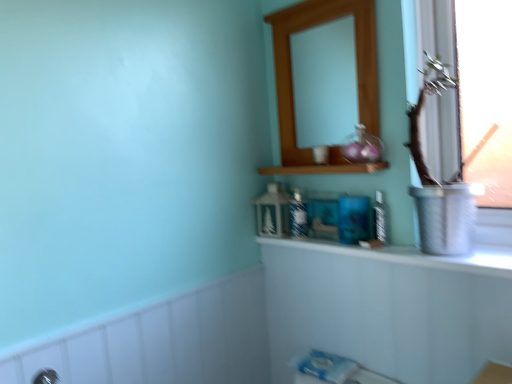
You are a GUI agent. You are given a task and a screenshot of the screen. Output one action in this format:
    pyautogui.click(x=<x>, y=<y>)
    Task: Click on the blank space situated above wooden shelf at upper center (from a real-world perspective)
    The width and height of the screenshot is (512, 384).
    Given the screenshot: What is the action you would take?
    pyautogui.click(x=318, y=159)